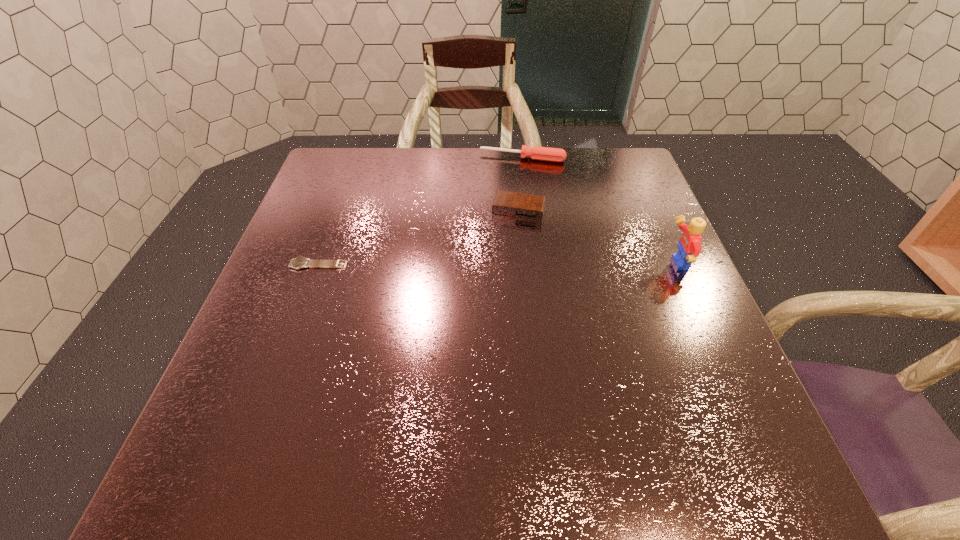
Locate an element on the screen. vacant space on the desktop that is between the shortest object and the rightmost object and is positioned at the blade of the screwdriver is located at coordinates (497, 265).

You are a GUI agent. You are given a task and a screenshot of the screen. Output one action in this format:
    pyautogui.click(x=<x>, y=<y>)
    Task: Click on the free spot on the desktop that is between the leftmost object and the tallest object and is positioned on the front face of the alarm clock
    Image resolution: width=960 pixels, height=540 pixels.
    Given the screenshot: What is the action you would take?
    pyautogui.click(x=504, y=265)